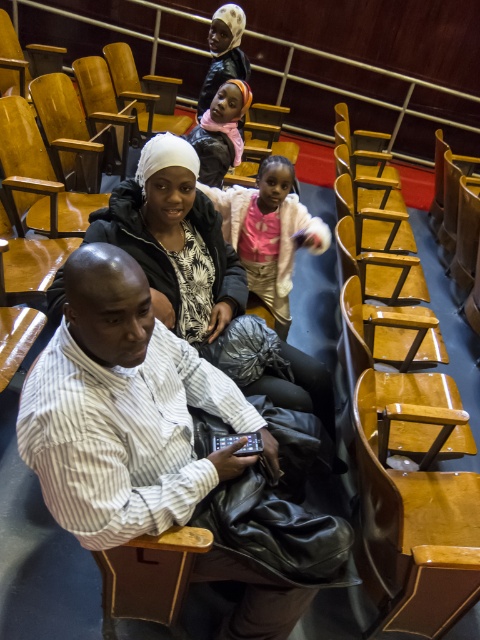
Question: Which point is farther to the camera?

Choices:
 (A) (220, 248)
 (B) (391, 486)

Answer: (A)

Question: Does striped cotton shirt at center appear over wooden polished chair at lower right?

Choices:
 (A) no
 (B) yes

Answer: (B)

Question: Does striped cotton shirt at center appear on the left side of wooden polished chair at lower right?

Choices:
 (A) no
 (B) yes

Answer: (B)

Question: Among these points, which one is nearest to the camera?

Choices:
 (A) (365, 465)
 (B) (271, 184)
 (C) (164, 392)
 (D) (320, 380)

Answer: (C)

Question: Is matte black jacket at center to the left of pink fleece jacket at center from the viewer's perspective?

Choices:
 (A) no
 (B) yes

Answer: (B)

Question: Among these objects, which one is farthest from the camera?

Choices:
 (A) matte black jacket at center
 (B) pink fleece jacket at center
 (C) wooden polished chair at lower right
 (D) striped cotton shirt at center

Answer: (B)